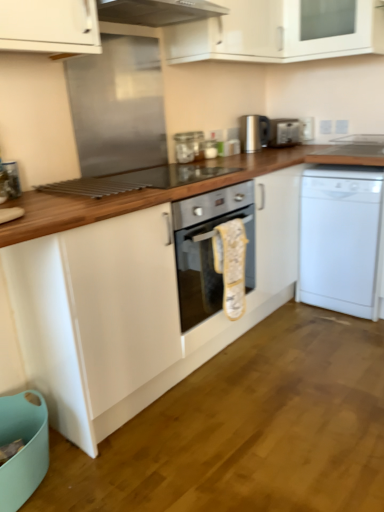
Question: Should I look upward or downward to see white glossy cabinet at upper center, which ranks as the first cabinetry in left-to-right order?

Choices:
 (A) up
 (B) down

Answer: (A)

Question: Is satin silver kettle at upper center, the first appliance in the left-to-right sequence, to the left of satin silver toaster at upper right, marked as the second appliance in a left-to-right arrangement, from the viewer's perspective?

Choices:
 (A) no
 (B) yes

Answer: (B)

Question: Is the position of satin silver kettle at upper center, the first appliance in the left-to-right sequence, less distant than that of satin silver toaster at upper right, marked as the second appliance in a left-to-right arrangement?

Choices:
 (A) yes
 (B) no

Answer: (A)

Question: Is satin silver kettle at upper center, the 2th appliance positioned from the right, oriented away from satin silver toaster at upper right, marked as the second appliance in a left-to-right arrangement?

Choices:
 (A) no
 (B) yes

Answer: (A)

Question: Does satin silver kettle at upper center, the 2th appliance positioned from the right, have a smaller size compared to satin silver toaster at upper right, marked as the second appliance in a left-to-right arrangement?

Choices:
 (A) no
 (B) yes

Answer: (A)

Question: From a real-world perspective, is satin silver kettle at upper center, the first appliance in the left-to-right sequence, physically below satin silver toaster at upper right, marked as the second appliance in a left-to-right arrangement?

Choices:
 (A) no
 (B) yes

Answer: (A)

Question: Is satin silver kettle at upper center, the 2th appliance positioned from the right, in contact with satin silver toaster at upper right, marked as the second appliance in a left-to-right arrangement?

Choices:
 (A) no
 (B) yes

Answer: (A)

Question: Is satin silver kettle at upper center, the first appliance in the left-to-right sequence, facing towards wooden at center?

Choices:
 (A) yes
 (B) no

Answer: (B)

Question: Can you confirm if satin silver kettle at upper center, the first appliance in the left-to-right sequence, is positioned to the left of wooden at center?

Choices:
 (A) no
 (B) yes

Answer: (A)

Question: Is satin silver kettle at upper center, the 2th appliance positioned from the right, wider than wooden at center?

Choices:
 (A) yes
 (B) no

Answer: (B)

Question: Are satin silver kettle at upper center, the 2th appliance positioned from the right, and wooden at center beside each other?

Choices:
 (A) yes
 (B) no

Answer: (B)

Question: Does satin silver kettle at upper center, the 2th appliance positioned from the right, have a greater height compared to wooden at center?

Choices:
 (A) no
 (B) yes

Answer: (A)

Question: From a real-world perspective, is satin silver kettle at upper center, the first appliance in the left-to-right sequence, located higher than wooden at center?

Choices:
 (A) yes
 (B) no

Answer: (A)

Question: From a real-world perspective, is white matte dishwasher at right on wooden at center?

Choices:
 (A) yes
 (B) no

Answer: (B)